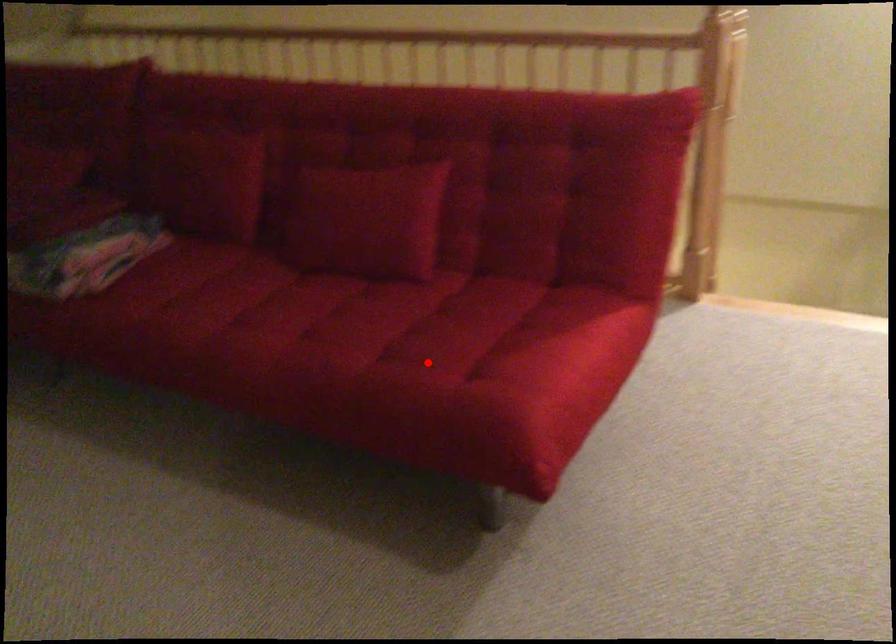
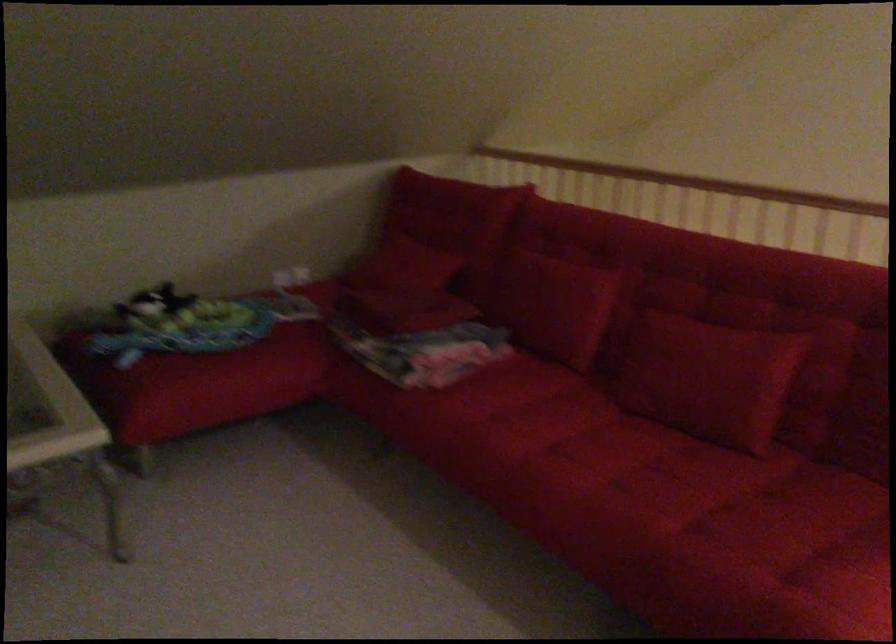
The point at the highlighted location is marked in the first image. Where is the corresponding point in the second image?

(754, 558)